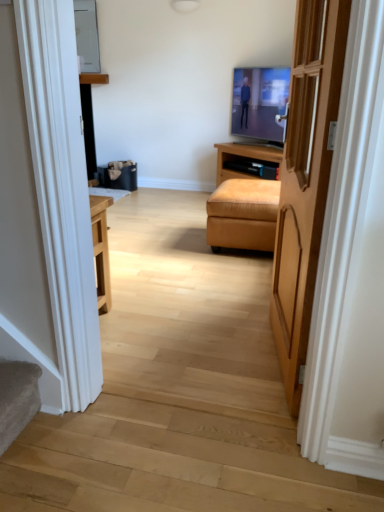
At what (x,y) coordinates should I click in order to perform the action: click on free point behind light brown wooden door at center. Please return your answer as a coordinate pair (x, y). Looking at the image, I should click on (235, 306).